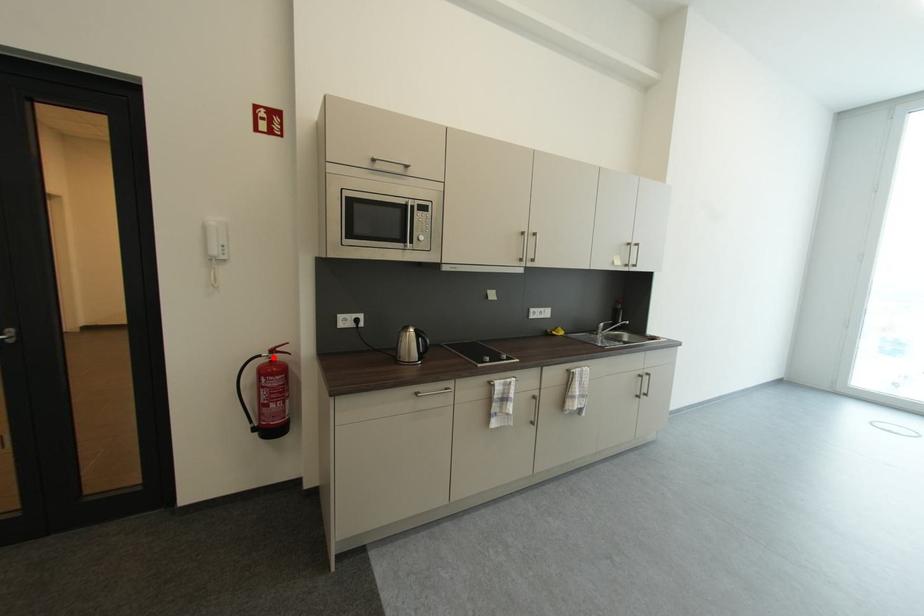
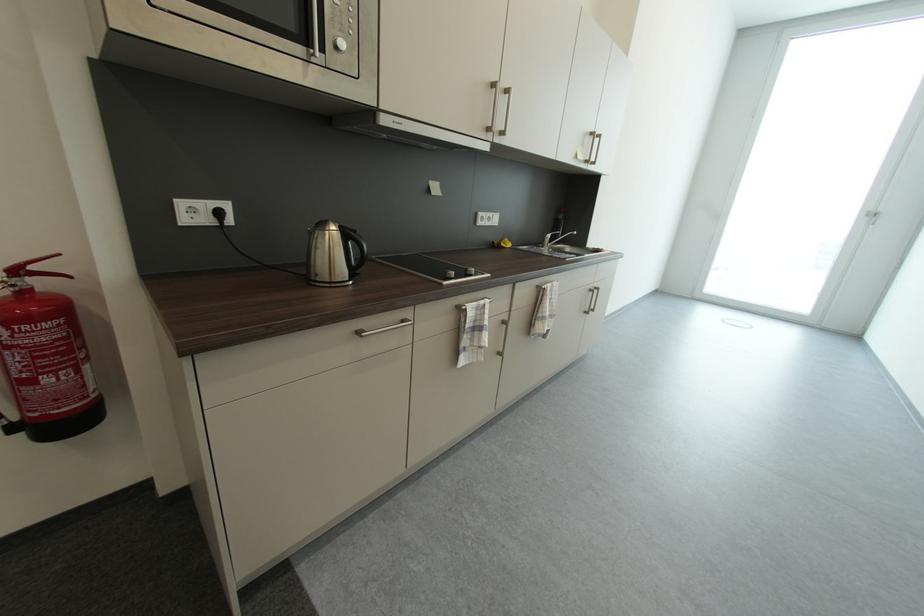
Where in the second image is the point corresponding to the highlighted location from the first image?

(8, 284)